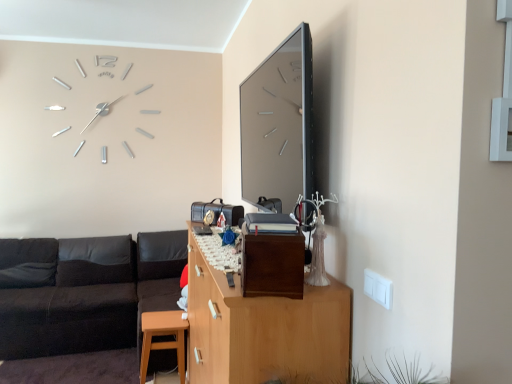
Question: In terms of height, does wooden cabinet at center look taller or shorter compared to black leather couch at lower left?

Choices:
 (A) short
 (B) tall

Answer: (B)

Question: Considering their positions, is wooden cabinet at center located in front of or behind black leather couch at lower left?

Choices:
 (A) front
 (B) behind

Answer: (A)

Question: Which is farther from the brown matte/file cabinet at center?

Choices:
 (A) matte wood stool at lower left
 (B) wooden cabinet at center
 (C) black leather couch at left
 (D) black leather couch at lower left

Answer: (C)

Question: Estimate the real-world distances between objects in this image. Which object is farther from the black leather couch at lower left?

Choices:
 (A) wooden cabinet at center
 (B) black leather couch at left
 (C) matte wood stool at lower left
 (D) brown matte/file cabinet at center

Answer: (D)